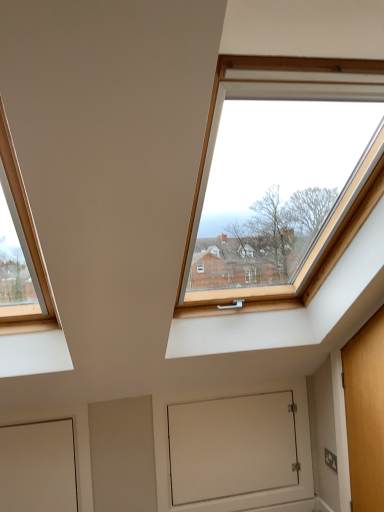
Question: Considering the positions of point (52, 421) and point (264, 417), is point (52, 421) closer or farther from the camera than point (264, 417)?

Choices:
 (A) closer
 (B) farther

Answer: (A)

Question: Is white matte door at lower left, the 2th door in the right-to-left sequence, situated inside white matte door at lower center or outside?

Choices:
 (A) inside
 (B) outside

Answer: (B)

Question: Estimate the real-world distances between objects in this image. Which object is farther from the white matte door at lower left, the 2th door in the right-to-left sequence?

Choices:
 (A) wooden door at right, the second door viewed from the left
 (B) white matte door at lower center

Answer: (A)

Question: Estimate the real-world distances between objects in this image. Which object is closer to the white matte door at lower center?

Choices:
 (A) white matte door at lower left, the 2th door in the right-to-left sequence
 (B) wooden door at right, the second door viewed from the left

Answer: (B)